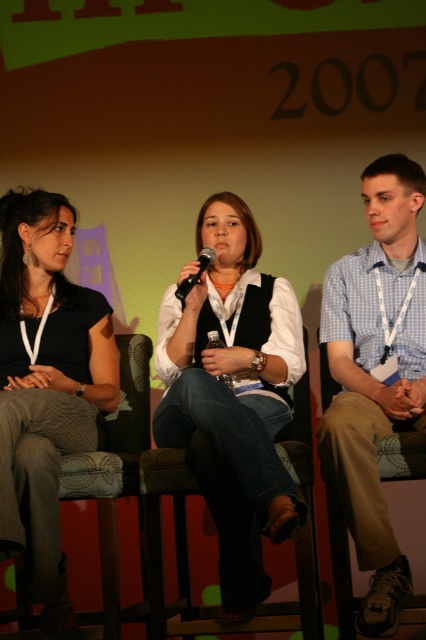
You are a photographer standing at the back of the room. You want to take a photo of the blue checkered shirt at center. Where should you aim your camera to capture it?

You should aim your camera at point 0.588 on the horizontal axis and 0.878 on the vertical axis to capture the blue checkered shirt at center.

You are a photographer positioned behind the camera, aiming to capture a clear shot of the blue checkered shirt at center and the black matte microphone at center. Which object should you focus on first to ensure it appears sharp in the photo?

The blue checkered shirt at center is much taller than the black matte microphone at center, so you should focus on the blue checkered shirt at center first to ensure it appears sharp.

You are a stagehand adjusting the microphone positions during a panel discussion. The matte black top at left is currently 23.65 inches away from the black matte microphone at center. Is this distance within the standard 24 inch microphone placement guideline for panel discussions?

The distance between the matte black top at left and the black matte microphone at center is 23.65 inches, which is just under the 24 inch guideline. Therefore, it meets the standard placement requirement.